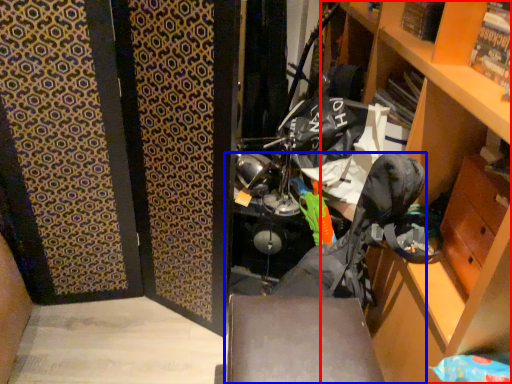
Question: Which object appears farthest to the camera in this image, cabinetry (highlighted by a red box) or folding chair (highlighted by a blue box)?

Choices:
 (A) cabinetry
 (B) folding chair

Answer: (B)